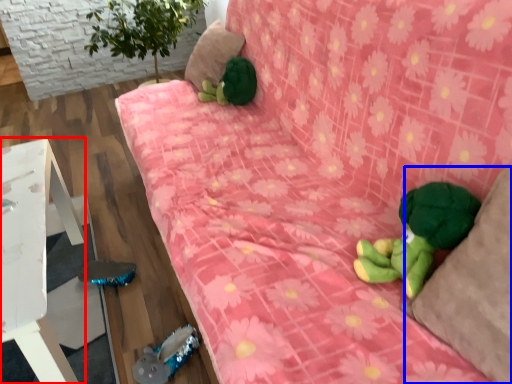
Question: Which point is further to the camera, furniture (highlighted by a red box) or pillow (highlighted by a blue box)?

Choices:
 (A) furniture
 (B) pillow

Answer: (A)